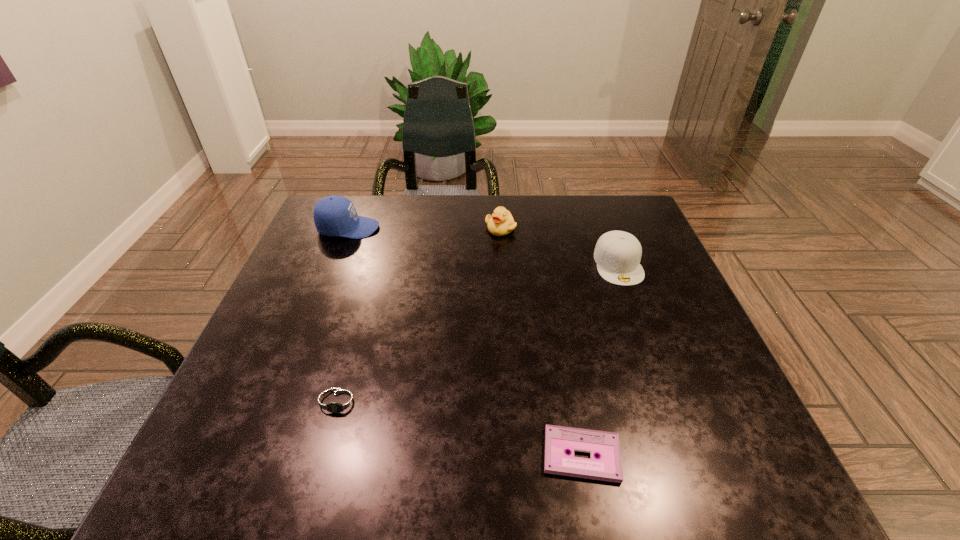
This screenshot has height=540, width=960. I want to click on vacant space that's between the shorter cap and the watch, so coord(479,333).

Image resolution: width=960 pixels, height=540 pixels. I want to click on free space that is in between the watch and the third object from left to right, so click(420, 315).

Locate an element on the screen. The height and width of the screenshot is (540, 960). vacant area between the shortest object and the third object from left to right is located at coordinates (541, 341).

This screenshot has height=540, width=960. Find the location of `vacant area that lies between the farther cap and the right cap`. vacant area that lies between the farther cap and the right cap is located at coordinates (483, 246).

Identify the location of vacant area that lies between the tallest object and the fourth tallest object. The image size is (960, 540). tap(345, 315).

The image size is (960, 540). In order to click on free space that is in between the left cap and the shortest object in this screenshot , I will do `click(465, 341)`.

Find the location of `empty space that is in between the videotape and the left cap`. empty space that is in between the videotape and the left cap is located at coordinates (465, 341).

The image size is (960, 540). Find the location of `vacant point located between the third farthest object and the tallest object`. vacant point located between the third farthest object and the tallest object is located at coordinates (483, 246).

Find the location of a particular element. object that stands as the second closest to the duckling is located at coordinates (335, 215).

Point out which object is positioned as the second nearest to the second shortest object. Please provide its 2D coordinates. Your answer should be formatted as a tuple, i.e. [(x, y)], where the tuple contains the x and y coordinates of a point satisfying the conditions above.

[(335, 215)]